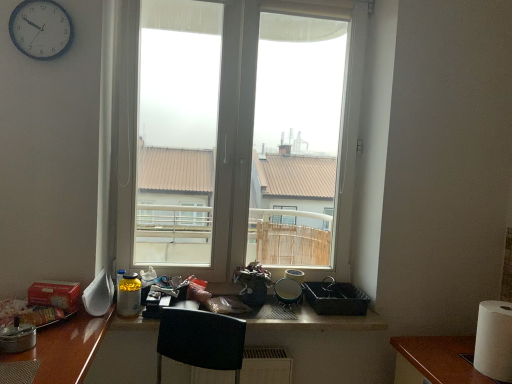
Question: Considering the relative positions of black woven basket at lower right, positioned as the fourth appliance in front-to-back order, and metallic silver pot at left, positioned as the 4th appliance in back-to-front order, in the image provided, is black woven basket at lower right, positioned as the fourth appliance in front-to-back order, to the right of metallic silver pot at left, positioned as the 4th appliance in back-to-front order, from the viewer's perspective?

Choices:
 (A) no
 (B) yes

Answer: (B)

Question: Is black woven basket at lower right, which is the first appliance in back-to-front order, wider than metallic silver pot at left, positioned as the fourth appliance in right-to-left order?

Choices:
 (A) no
 (B) yes

Answer: (B)

Question: From a real-world perspective, is black woven basket at lower right, the 4th appliance positioned from the left, located beneath metallic silver pot at left, positioned as the fourth appliance in right-to-left order?

Choices:
 (A) no
 (B) yes

Answer: (B)

Question: Does black woven basket at lower right, which is the first appliance in back-to-front order, appear on the left side of metallic silver pot at left, positioned as the fourth appliance in right-to-left order?

Choices:
 (A) no
 (B) yes

Answer: (A)

Question: Considering the relative sizes of black woven basket at lower right, positioned as the fourth appliance in front-to-back order, and metallic silver pot at left, the 1th appliance viewed from the left, in the image provided, is black woven basket at lower right, positioned as the fourth appliance in front-to-back order, bigger than metallic silver pot at left, the 1th appliance viewed from the left,?

Choices:
 (A) no
 (B) yes

Answer: (B)

Question: From the image's perspective, is white paper at right located above or below black woven basket at lower right, which is the first appliance in back-to-front order?

Choices:
 (A) below
 (B) above

Answer: (A)

Question: Is point (488, 322) positioned closer to the camera than point (340, 312)?

Choices:
 (A) farther
 (B) closer

Answer: (B)

Question: From a real-world perspective, relative to black woven basket at lower right, positioned as the fourth appliance in front-to-back order, is white paper at right vertically above or below?

Choices:
 (A) below
 (B) above

Answer: (B)

Question: From their relative heights in the image, would you say white paper at right is taller or shorter than black woven basket at lower right, which is the first appliance in back-to-front order?

Choices:
 (A) short
 (B) tall

Answer: (B)

Question: In the image, is white paper at right positioned in front of or behind metallic silver frying pan at center, which is counted as the second appliance, starting from the back?

Choices:
 (A) behind
 (B) front

Answer: (B)

Question: From a real-world perspective, is white paper at right physically located above or below metallic silver frying pan at center, positioned as the third appliance in front-to-back order?

Choices:
 (A) below
 (B) above

Answer: (B)

Question: Do you think white paper at right is within metallic silver frying pan at center, which is the 2th appliance from right to left, or outside of it?

Choices:
 (A) inside
 (B) outside

Answer: (B)

Question: Considering the positions of white paper at right and metallic silver frying pan at center, which is the 2th appliance from right to left, in the image, is white paper at right bigger or smaller than metallic silver frying pan at center, which is the 2th appliance from right to left,?

Choices:
 (A) small
 (B) big

Answer: (B)

Question: From a real-world perspective, relative to white paper at right, is white glossy spoon at left, the third appliance from the right, vertically above or below?

Choices:
 (A) above
 (B) below

Answer: (A)

Question: Considering the positions of point (109, 279) and point (485, 367), is point (109, 279) closer or farther from the camera than point (485, 367)?

Choices:
 (A) closer
 (B) farther

Answer: (B)